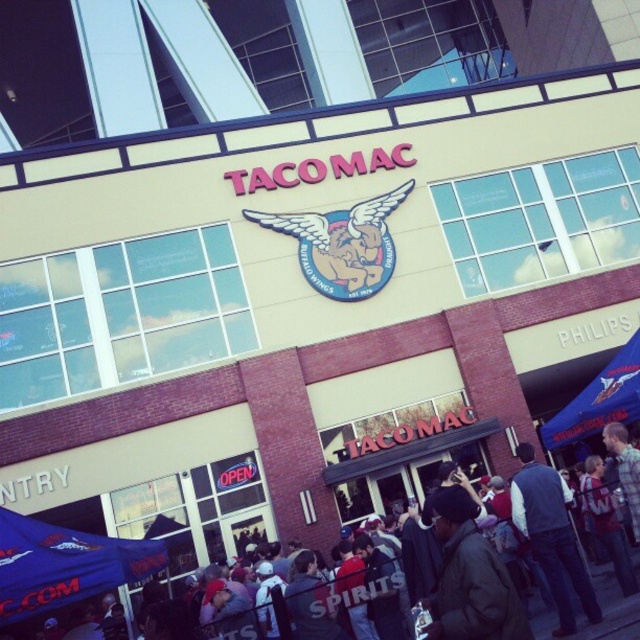
You are standing in front of the TACOMAC building and notice two people in the crowd. One is wearing a dark brown jacket at center and the other a dark blue vest at center. Which person is standing to the left of the other?

The dark brown jacket at center is positioned on the left side of the dark blue vest at center.

You are standing in front of the TACOMAC building and notice a blue fabric canopy at lower left and a dark brown jacket at center. Which object is taller?

The dark brown jacket at center is taller than the blue fabric canopy at lower left.